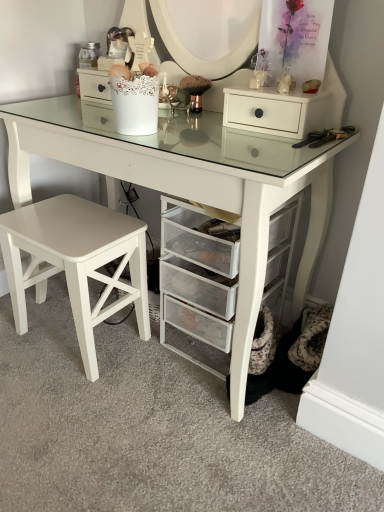
What are the coordinates of `empty space that is ontop of white matte stool at lower left (from a real-world perspective)` in the screenshot? It's located at (64, 220).